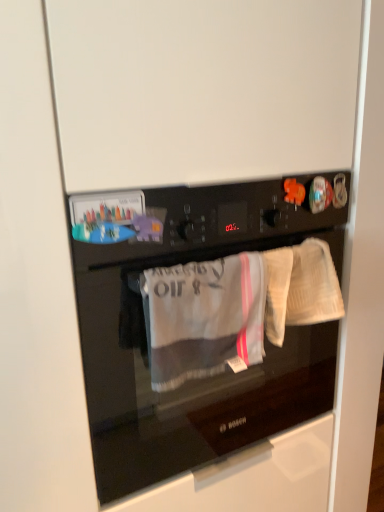
Question: Would you say white textured towel at right is part of black glass oven at center's contents?

Choices:
 (A) no
 (B) yes

Answer: (A)

Question: Can you confirm if black glass oven at center is taller than white textured towel at right?

Choices:
 (A) yes
 (B) no

Answer: (A)

Question: Can you confirm if black glass oven at center is smaller than white textured towel at right?

Choices:
 (A) yes
 (B) no

Answer: (B)

Question: Is black glass oven at center turned away from white textured towel at right?

Choices:
 (A) no
 (B) yes

Answer: (A)

Question: Does black glass oven at center come in front of white textured towel at right?

Choices:
 (A) yes
 (B) no

Answer: (A)

Question: Is black glass oven at center positioned far away from white textured towel at right?

Choices:
 (A) no
 (B) yes

Answer: (A)

Question: Can you confirm if gray cotton towel at center is positioned to the right of white textured towel at right?

Choices:
 (A) no
 (B) yes

Answer: (A)

Question: Would you say gray cotton towel at center contains white textured towel at right?

Choices:
 (A) no
 (B) yes

Answer: (A)

Question: Is gray cotton towel at center positioned in front of white textured towel at right?

Choices:
 (A) yes
 (B) no

Answer: (A)

Question: Considering the relative sizes of gray cotton towel at center and white textured towel at right in the image provided, is gray cotton towel at center taller than white textured towel at right?

Choices:
 (A) yes
 (B) no

Answer: (A)

Question: Is gray cotton towel at center not within white textured towel at right?

Choices:
 (A) no
 (B) yes

Answer: (B)

Question: From a real-world perspective, is gray cotton towel at center beneath white textured towel at right?

Choices:
 (A) no
 (B) yes

Answer: (B)

Question: Can you confirm if white textured towel at right is shorter than black glass oven at center?

Choices:
 (A) yes
 (B) no

Answer: (A)